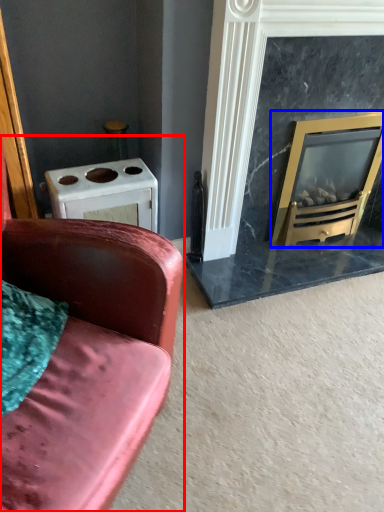
Question: Which object is closer to the camera taking this photo, studio couch (highlighted by a red box) or wood burning stove (highlighted by a blue box)?

Choices:
 (A) studio couch
 (B) wood burning stove

Answer: (A)